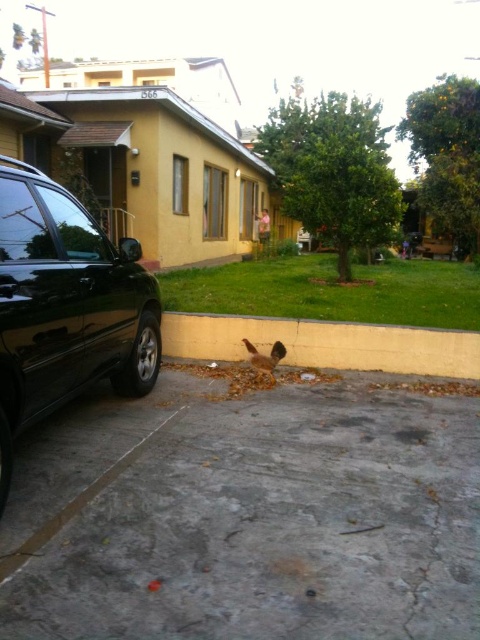
You are a delivery person trying to park your 1.5 meter wide delivery van between the gray concrete pavement at lower center and the black glossy suv at left. Can you fit your van in that space?

The distance between the gray concrete pavement at lower center and the black glossy suv at left is 1.19 meters, which is narrower than your 1.5 meter wide delivery van. Therefore, you cannot fit your van in that space.

You are a delivery person trying to park your van in the driveway. The van requires a clear path that is at least 2 meters tall. Can the van pass through the space between the gray concrete pavement at lower center and the brown feathered bird at lower center?

The gray concrete pavement at lower center is taller than the brown feathered bird at lower center. The height of the tallest object in this area is the gray concrete pavement at lower center. However, the exact height of the gray concrete pavement at lower center is not provided, so it is uncertain if the van can pass through the space. More information about the height of the gray concrete pavement at lower center is needed to determine this.

You are a delivery person who needs to place a package on the gray concrete pavement at lower center. However, there is a brown feathered bird at lower center nearby. How far apart are these two objects?

The gray concrete pavement at lower center is 1.81 meters from the brown feathered bird at lower center.